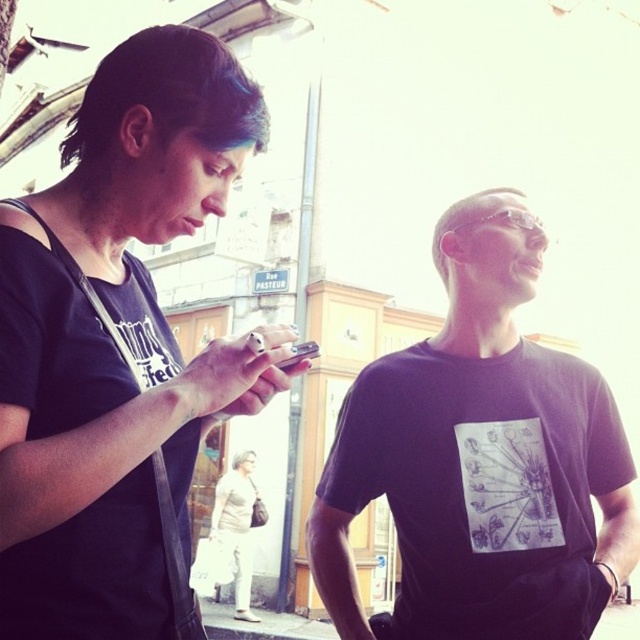
Describe the element at coordinates (236, 531) in the screenshot. I see `white cotton pants at lower center` at that location.

Which is more to the left, white cotton pants at lower center or silver metallic smartphone at center?

Positioned to the left is white cotton pants at lower center.

The width and height of the screenshot is (640, 640). What are the coordinates of `white cotton pants at lower center` in the screenshot? It's located at (236, 531).

Locate an element on the screen. This screenshot has width=640, height=640. white cotton pants at lower center is located at coordinates (236, 531).

Does matte black t-shirt at center appear on the right side of silver metallic smartphone at center?

No, matte black t-shirt at center is not to the right of silver metallic smartphone at center.

Between matte black t-shirt at center and silver metallic smartphone at center, which one is positioned lower?

silver metallic smartphone at center

Who is more distant from viewer, (154, 298) or (300, 344)?

The point (154, 298) is behind.

Image resolution: width=640 pixels, height=640 pixels. Identify the location of matte black t-shirt at center. (120, 348).

Is matte black t-shirt at center to the left of black matte t-shirt at center from the viewer's perspective?

Indeed, matte black t-shirt at center is positioned on the left side of black matte t-shirt at center.

Does matte black t-shirt at center have a lesser width compared to black matte t-shirt at center?

Indeed, matte black t-shirt at center has a lesser width compared to black matte t-shirt at center.

Between point (16, 269) and point (396, 364), which one is positioned behind?

Point (396, 364)

Image resolution: width=640 pixels, height=640 pixels. Identify the location of matte black t-shirt at center. (120, 348).